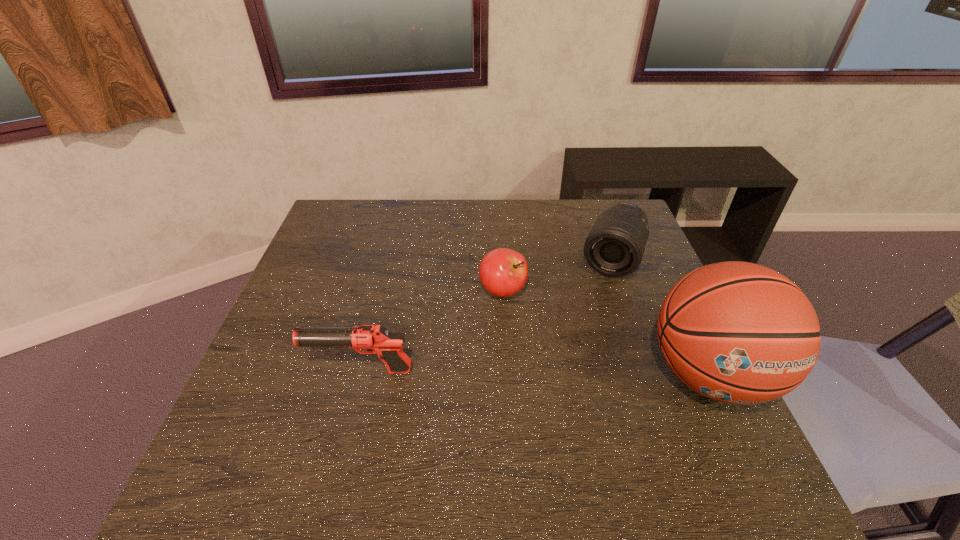
Locate an element on the screen. This screenshot has width=960, height=540. vacant region at the right edge of the desktop is located at coordinates (666, 362).

This screenshot has height=540, width=960. I want to click on vacant position at the near left corner of the desktop, so click(x=233, y=443).

Identify the location of vacant space that's between the second object from left to right and the telephoto lens. The width and height of the screenshot is (960, 540). (557, 275).

The height and width of the screenshot is (540, 960). What are the coordinates of `unoccupied position between the apple and the gun` in the screenshot? It's located at (432, 330).

Where is `free space between the leftmost object and the basketball`? The width and height of the screenshot is (960, 540). free space between the leftmost object and the basketball is located at coordinates (535, 373).

This screenshot has height=540, width=960. In order to click on vacant point located between the basketball and the apple in this screenshot , I will do `click(606, 333)`.

Identify the location of empty space that is in between the telephoto lens and the third object from right to left. The width and height of the screenshot is (960, 540). (557, 275).

This screenshot has width=960, height=540. What are the coordinates of `free point between the basketball and the leftmost object` in the screenshot? It's located at pos(535,373).

The height and width of the screenshot is (540, 960). In order to click on empty space that is in between the apple and the gun in this screenshot , I will do `click(432, 330)`.

You are a GUI agent. You are given a task and a screenshot of the screen. Output one action in this format:
    pyautogui.click(x=<x>, y=<y>)
    Task: Click on the second closest object relative to the gun
    This screenshot has height=540, width=960.
    Given the screenshot: What is the action you would take?
    pyautogui.click(x=615, y=246)